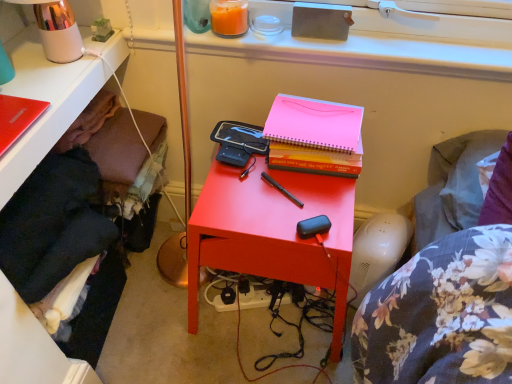
I want to click on free spot above matte red nightstand at center (from a real-world perspective), so click(270, 181).